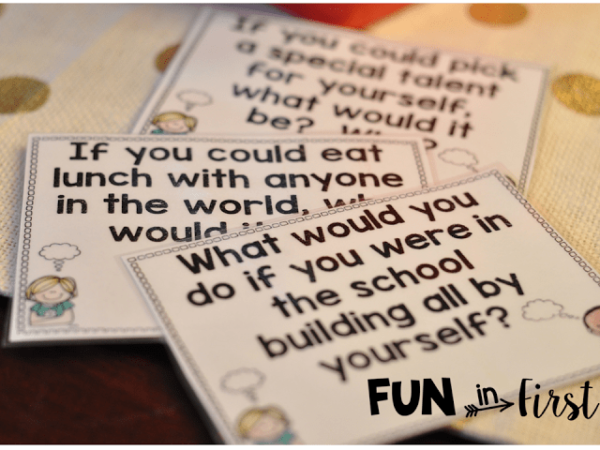
I want to click on table, so 66,413.